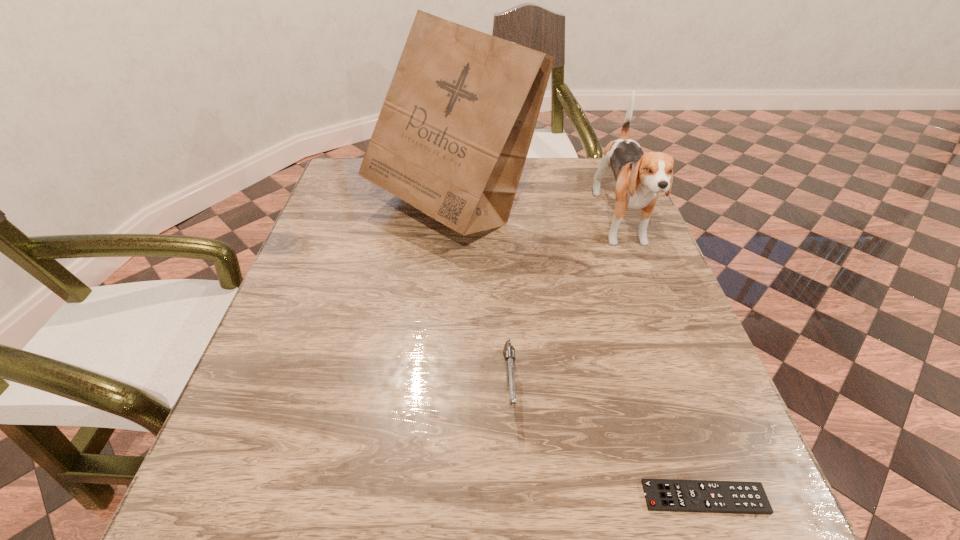
This screenshot has width=960, height=540. In order to click on grocery bag that is positioned at the far edge in this screenshot , I will do `click(452, 137)`.

The image size is (960, 540). I want to click on puppy at the far edge, so click(640, 177).

Find the location of a particular element. This screenshot has height=540, width=960. object present at the near edge is located at coordinates (736, 497).

Locate an element on the screen. The image size is (960, 540). object that is positioned at the left edge is located at coordinates (452, 137).

Identify the location of puppy that is at the right edge. The width and height of the screenshot is (960, 540). (640, 177).

I want to click on remote control at the right edge, so click(736, 497).

Locate an element on the screen. object at the far left corner is located at coordinates (452, 137).

I want to click on object located in the far right corner section of the desktop, so click(640, 177).

In order to click on object that is at the near right corner in this screenshot , I will do `click(736, 497)`.

The image size is (960, 540). In the image, there is a desktop. Identify the location of free space at the far edge. (540, 192).